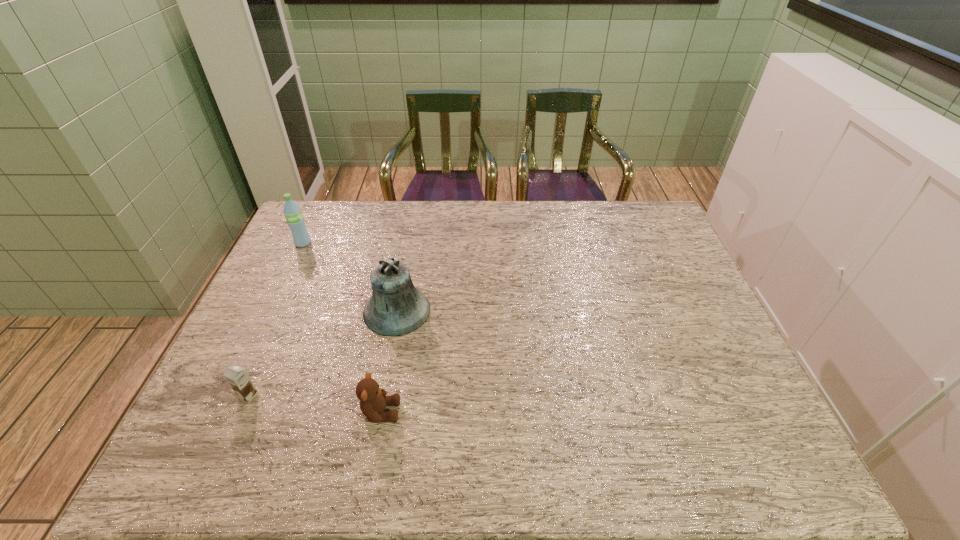
The width and height of the screenshot is (960, 540). I want to click on vacant space that is in between the chocolate milk and the teddy bear, so click(315, 404).

At what (x,y) coordinates should I click in order to perform the action: click on unoccupied position between the bell and the teddy bear. Please return your answer as a coordinate pair (x, y). This screenshot has height=540, width=960. Looking at the image, I should click on (389, 361).

Where is `free spot between the water bottle and the chocolate milk`? free spot between the water bottle and the chocolate milk is located at coordinates (276, 319).

Where is `unoccupied area between the water bottle and the third nearest object`? Image resolution: width=960 pixels, height=540 pixels. unoccupied area between the water bottle and the third nearest object is located at coordinates (350, 276).

Where is `free space between the teddy bear and the bell`? free space between the teddy bear and the bell is located at coordinates (389, 361).

Locate an element on the screen. Image resolution: width=960 pixels, height=540 pixels. vacant space that is in between the teddy bear and the bell is located at coordinates [389, 361].

You are a GUI agent. You are given a task and a screenshot of the screen. Output one action in this format:
    pyautogui.click(x=<x>, y=<y>)
    Task: Click on the blank region between the water bottle and the second farthest object
    The image size is (960, 540).
    Given the screenshot: What is the action you would take?
    pyautogui.click(x=350, y=276)

At what (x,y) coordinates should I click in order to perform the action: click on unoccupied area between the teddy bear and the water bottle. Please return your answer as a coordinate pair (x, y). The width and height of the screenshot is (960, 540). Looking at the image, I should click on (342, 328).

Find the location of a particular element. The image size is (960, 540). object that can be found as the third closest to the teddy bear is located at coordinates (295, 220).

You are a GUI agent. You are given a task and a screenshot of the screen. Output one action in this format:
    pyautogui.click(x=<x>, y=<y>)
    Task: Click on the object that is the third closest to the water bottle
    
    Given the screenshot: What is the action you would take?
    373,400